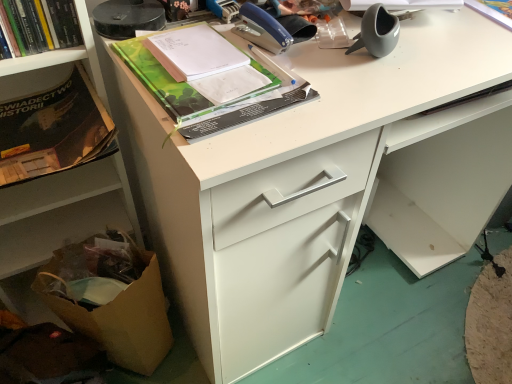
Find the location of a particular element. The width and height of the screenshot is (512, 384). spots to the right of green matte book at upper center, acting as the 2th book starting from the right is located at coordinates (346, 81).